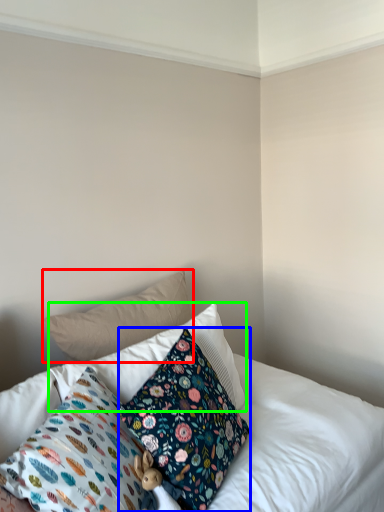
Question: Which object is the closest to the pillow (highlighted by a red box)? Choose among these: pillow (highlighted by a blue box) or pillow (highlighted by a green box).

Choices:
 (A) pillow
 (B) pillow

Answer: (B)